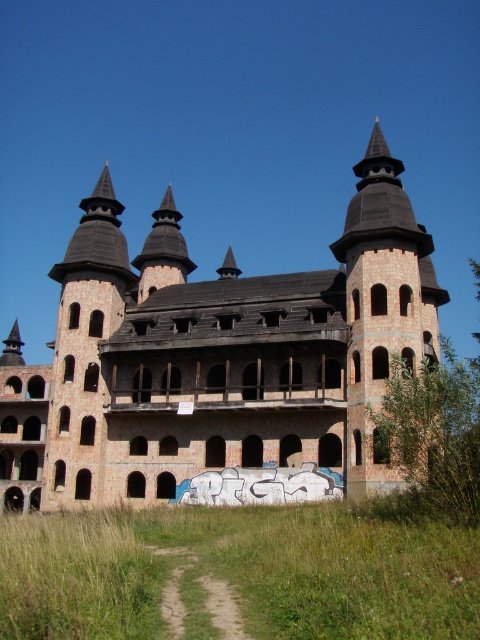
You are a drone operator tasked with flying a drone through the narrowest gap between the brown brick castle at center and the brown stone tower at upper right. The drone has a wingspan of 0.5 meters. Can you safely navigate through the gap?

The gap between the brown brick castle at center and the brown stone tower at upper right is 0.6 meters, so the drone with a 0.5 meter wingspan can safely pass through the gap.

You are planning to install a flagpole on the tallest structure in the image. Which object should you choose between the brown brick castle at center and the brown stone tower at upper right?

The brown brick castle at center is much taller than the brown stone tower at upper right, so you should install the flagpole on the brown brick castle at center.